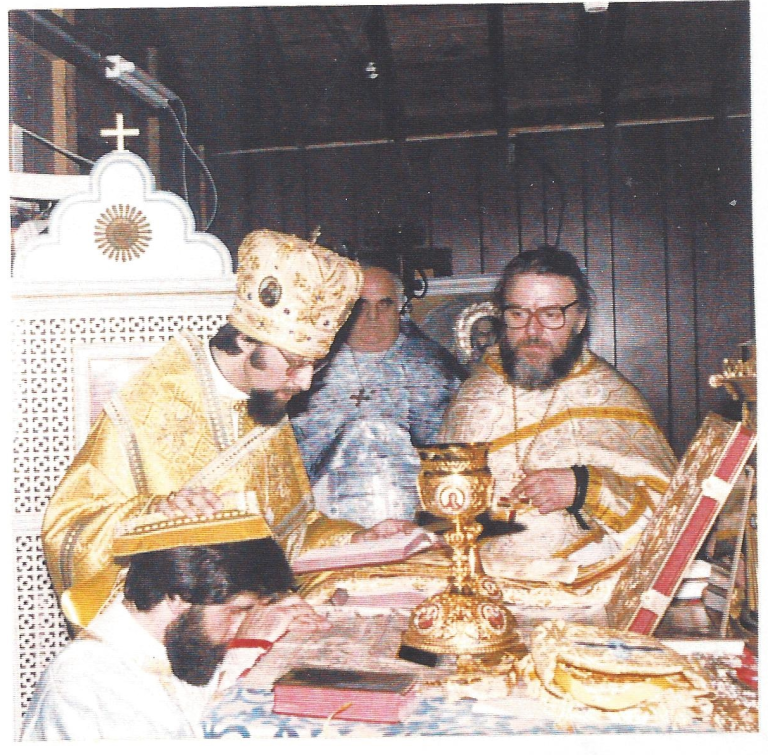
At what (x,y) coordinates should I click in order to perform the action: click on tablecloth. Please return your answer as a coordinate pair (x, y). Looking at the image, I should click on (229, 728).